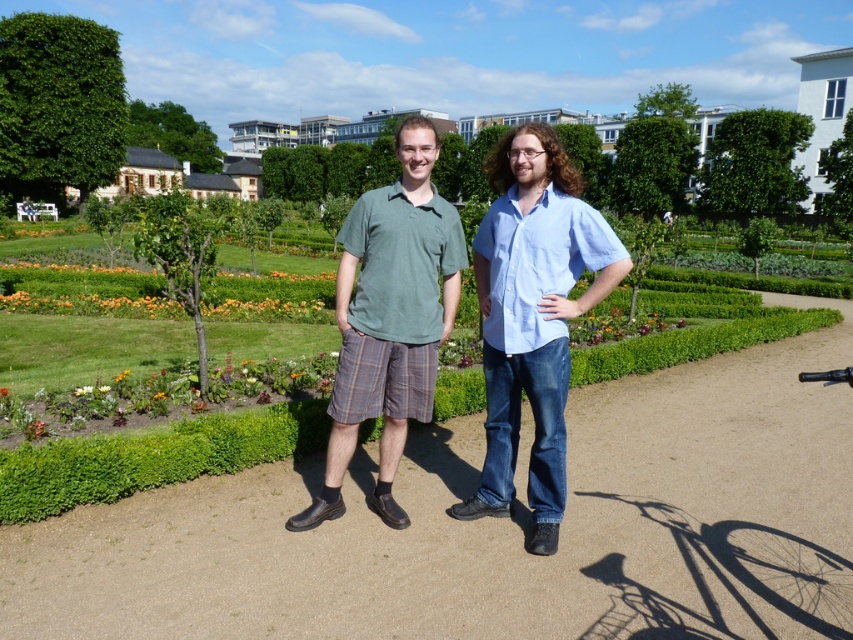
You are a photographer trying to capture a photo of the matte green shirt at center and the green leafy hedge at upper left. Which object is positioned closer to the camera?

The matte green shirt at center is closer to the viewer than the green leafy hedge at upper left, so it will appear closer to the camera.

You are a photographer trying to capture the two people in the scene. You want to ensure both the matte green shirt at center and the green cotton polo shirt at center are clearly visible in your photo. Which shirt should you focus on first if you want to capture the one that is more to the right?

The matte green shirt at center is positioned on the right side of green cotton polo shirt at center, so you should focus on the matte green shirt at center first as it is more to the right.